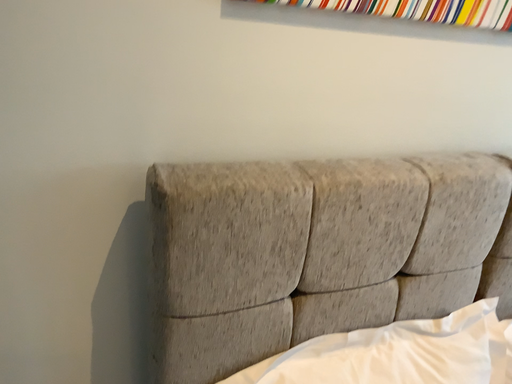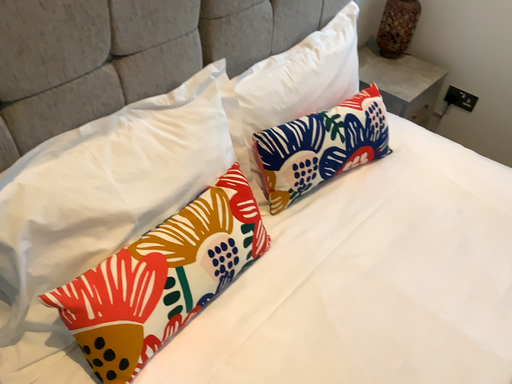
Question: Which way did the camera rotate in the video?

Choices:
 (A) rotated upward
 (B) rotated downward

Answer: (B)